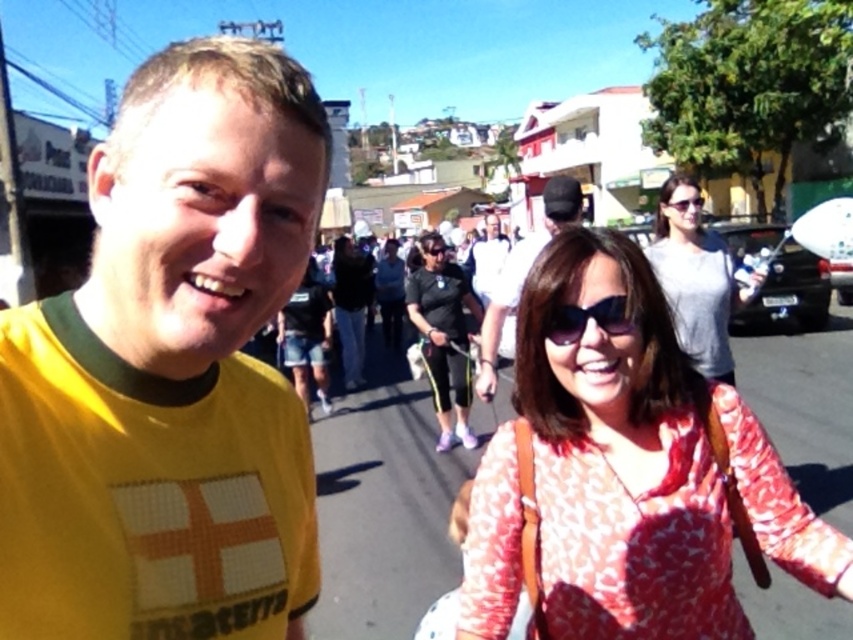
Is point (679, 268) less distant than point (503, 284)?

Yes, it is in front of point (503, 284).

Is gray cotton shirt at upper right closer to the viewer compared to matte black cap at center?

No, gray cotton shirt at upper right is further to the viewer.

The width and height of the screenshot is (853, 640). Identify the location of gray cotton shirt at upper right. (697, 280).

How much distance is there between printed cotton blouse at center and black plastic goggles at center?

printed cotton blouse at center and black plastic goggles at center are 5.88 meters apart from each other.

Does point (608, 637) come farther from viewer compared to point (432, 246)?

No, it is in front of (432, 246).

Find the location of a particular element. The image size is (853, 640). printed cotton blouse at center is located at coordinates (643, 465).

Between gray cotton shirt at upper right and white matte shirt at center, which one is positioned lower?

gray cotton shirt at upper right

Is point (720, 289) positioned before point (471, 288)?

Yes, it is.

Where is `gray cotton shirt at upper right`? The width and height of the screenshot is (853, 640). gray cotton shirt at upper right is located at coordinates (697, 280).